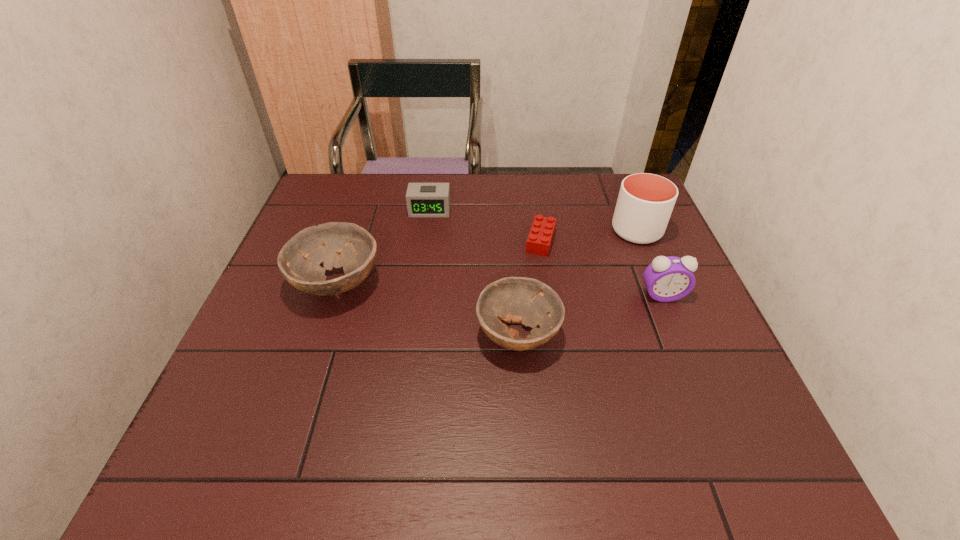
Locate an element on the screen. Image resolution: width=960 pixels, height=540 pixels. free space located on the back of the taller bowl is located at coordinates [366, 199].

Where is `vacant space located 0.280m on the right of the shorter bowl`? This screenshot has width=960, height=540. vacant space located 0.280m on the right of the shorter bowl is located at coordinates (685, 334).

This screenshot has height=540, width=960. Find the location of `free space located on the front-facing side of the fifth tallest object`. free space located on the front-facing side of the fifth tallest object is located at coordinates (424, 253).

Locate an element on the screen. The width and height of the screenshot is (960, 540). vacant point located 0.060m on the front of the cup is located at coordinates [x=650, y=262].

Locate an element on the screen. free space located on the front of the shortest object is located at coordinates (554, 327).

This screenshot has width=960, height=540. Identify the location of vacant space located on the face of the taller alarm clock. (676, 328).

At what (x,y) coordinates should I click in order to perform the action: click on alarm clock at the far edge. Please return your answer as a coordinate pair (x, y). Looking at the image, I should click on (424, 200).

I want to click on cup that is positioned at the far edge, so click(645, 202).

Locate an element on the screen. object that is at the left edge is located at coordinates (299, 260).

Find the location of `cup located at the right edge`. cup located at the right edge is located at coordinates (645, 202).